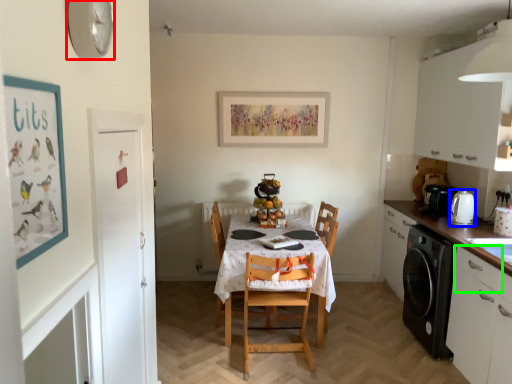
Question: Based on their relative distances, which object is nearer to clock (highlighted by a red box)? Choose from appliance (highlighted by a blue box) and drawer (highlighted by a green box).

Choices:
 (A) appliance
 (B) drawer

Answer: (B)